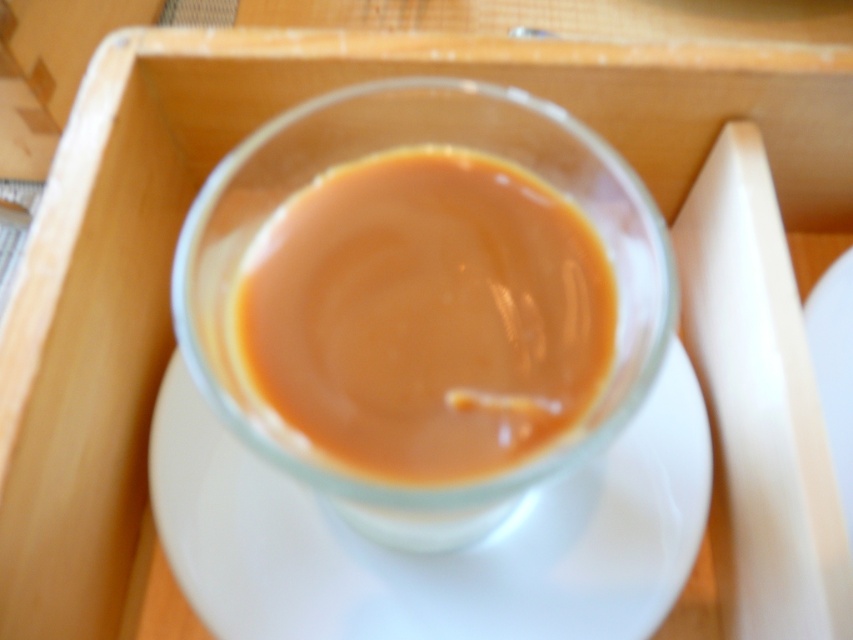
Question: Can you confirm if translucent glass cup at center is positioned above white ceramic saucer at center?

Choices:
 (A) no
 (B) yes

Answer: (B)

Question: Which of the following is the farthest from the observer?

Choices:
 (A) (299, 224)
 (B) (402, 584)

Answer: (B)

Question: Does translucent glass cup at center appear on the left side of white ceramic saucer at center?

Choices:
 (A) no
 (B) yes

Answer: (A)

Question: Is translucent glass cup at center smaller than white ceramic saucer at center?

Choices:
 (A) yes
 (B) no

Answer: (A)

Question: Which point appears closest to the camera in this image?

Choices:
 (A) (236, 483)
 (B) (332, 186)

Answer: (B)